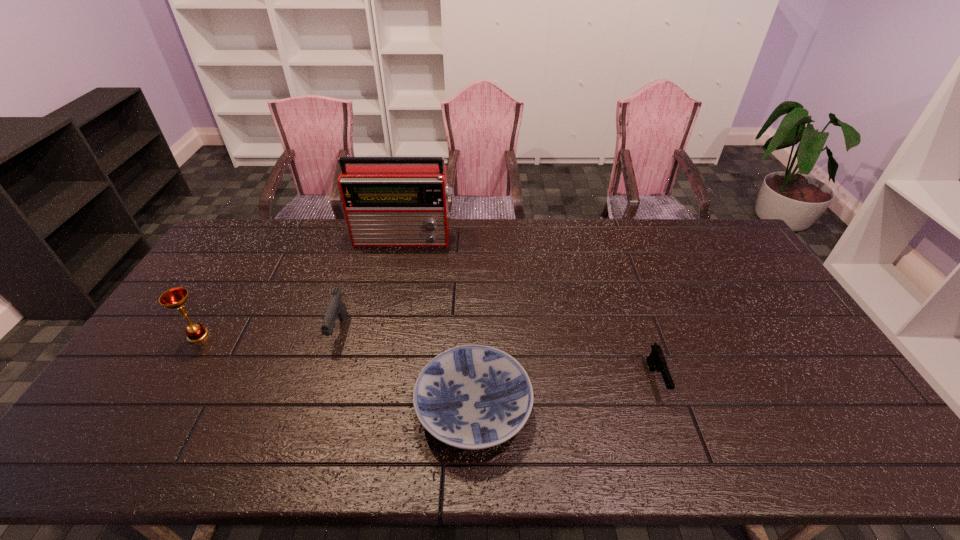
This screenshot has height=540, width=960. I want to click on vacant point located between the rightmost object and the plate, so click(564, 394).

Choose which object is the fourth nearest neighbor to the plate. Please provide its 2D coordinates. Your answer should be formatted as a tuple, i.e. [(x, y)], where the tuple contains the x and y coordinates of a point satisfying the conditions above.

[(175, 298)]

Locate an element on the screen. The image size is (960, 540). the third closest object relative to the tallest object is located at coordinates (472, 397).

At what (x,y) coordinates should I click in order to perform the action: click on free spot that satisfies the following two spatial constraints: 1. on the front-facing side of the tallest object; 2. on the left side of the plate. Please return your answer as a coordinate pair (x, y). Image resolution: width=960 pixels, height=540 pixels. Looking at the image, I should click on (370, 408).

Locate an element on the screen. free space that satisfies the following two spatial constraints: 1. on the front-facing side of the tallest object; 2. on the right side of the plate is located at coordinates (370, 408).

Find the location of a particular element. This screenshot has height=540, width=960. free location that satisfies the following two spatial constraints: 1. on the front-facing side of the plate; 2. on the left side of the farthest object is located at coordinates (370, 408).

Find the location of a particular element. The width and height of the screenshot is (960, 540). free location that satisfies the following two spatial constraints: 1. at the barrel of the farther pistol; 2. on the left side of the plate is located at coordinates (314, 408).